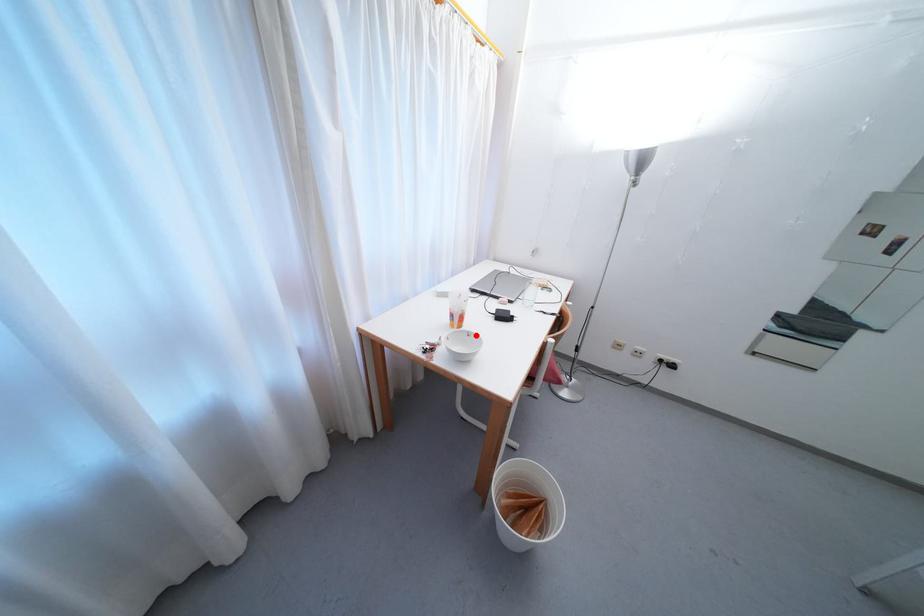
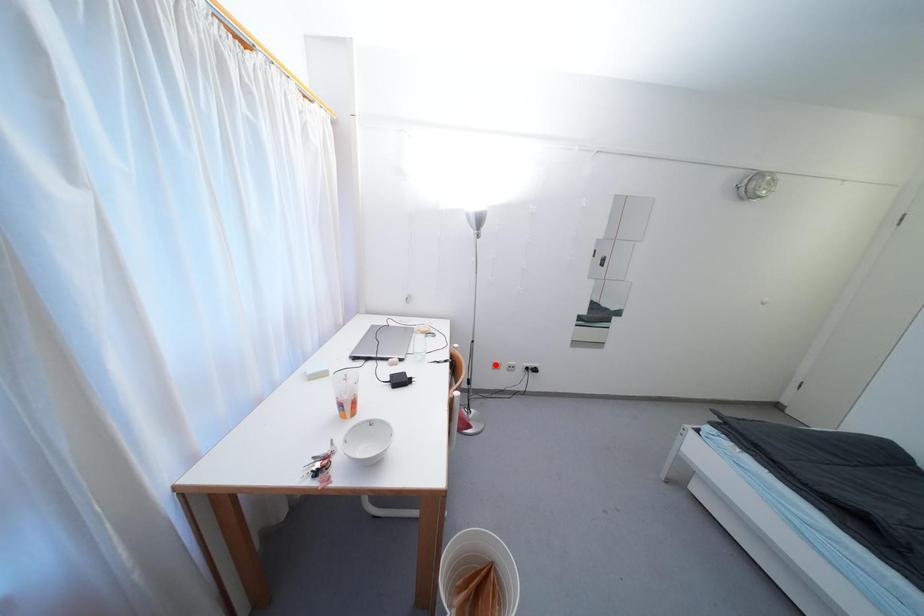
I am providing you with two images of the same scene from different viewpoints. A red point is marked on the first image and another point is marked on the second image. Is the marked point in image1 the same physical position as the marked point in image2?

No